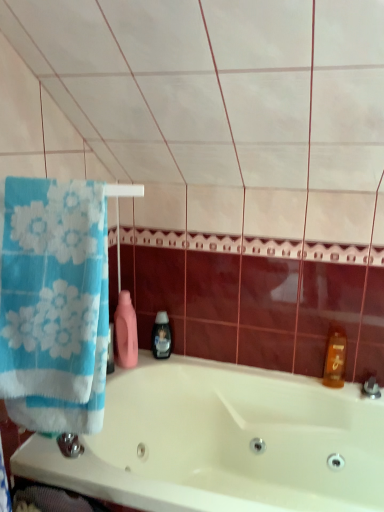
Question: Can you confirm if black plastic soap dispenser at center is positioned to the right of translucent amber bottle at right?

Choices:
 (A) no
 (B) yes

Answer: (A)

Question: Is black plastic soap dispenser at center outside of translucent amber bottle at right?

Choices:
 (A) no
 (B) yes

Answer: (B)

Question: Can you confirm if black plastic soap dispenser at center is smaller than translucent amber bottle at right?

Choices:
 (A) no
 (B) yes

Answer: (B)

Question: Is black plastic soap dispenser at center in contact with translucent amber bottle at right?

Choices:
 (A) yes
 (B) no

Answer: (B)

Question: Would you say black plastic soap dispenser at center contains translucent amber bottle at right?

Choices:
 (A) yes
 (B) no

Answer: (B)

Question: In terms of size, does black plastic soap dispenser at center appear bigger or smaller than translucent amber bottle at right?

Choices:
 (A) small
 (B) big

Answer: (A)

Question: In the image, is black plastic soap dispenser at center on the left side or the right side of translucent amber bottle at right?

Choices:
 (A) right
 (B) left

Answer: (B)

Question: From a real-world perspective, relative to translucent amber bottle at right, is black plastic soap dispenser at center vertically above or below?

Choices:
 (A) below
 (B) above

Answer: (B)

Question: In terms of height, does black plastic soap dispenser at center look taller or shorter compared to translucent amber bottle at right?

Choices:
 (A) tall
 (B) short

Answer: (A)

Question: From the image's perspective, is white glossy bathtub at center located above or below blue cotton towel at left?

Choices:
 (A) below
 (B) above

Answer: (A)

Question: Is point (375, 418) closer or farther from the camera than point (71, 206)?

Choices:
 (A) farther
 (B) closer

Answer: (A)

Question: From a real-world perspective, is white glossy bathtub at center positioned above or below blue cotton towel at left?

Choices:
 (A) below
 (B) above

Answer: (A)

Question: In terms of width, does white glossy bathtub at center look wider or thinner when compared to blue cotton towel at left?

Choices:
 (A) thin
 (B) wide

Answer: (B)

Question: Looking at their shapes, would you say black plastic soap dispenser at center is wider or thinner than white glossy bathtub at center?

Choices:
 (A) wide
 (B) thin

Answer: (B)

Question: From the image's perspective, is black plastic soap dispenser at center above or below white glossy bathtub at center?

Choices:
 (A) below
 (B) above

Answer: (B)